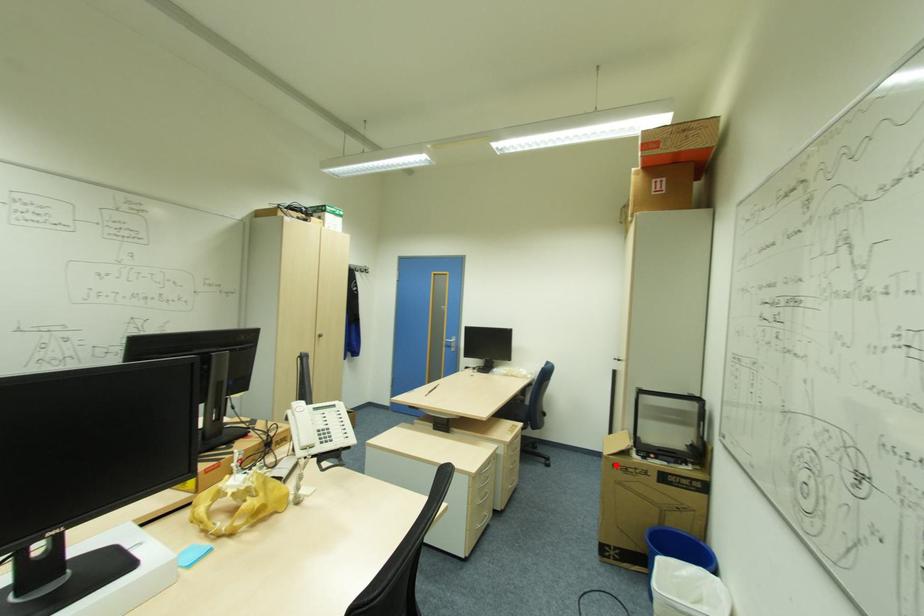
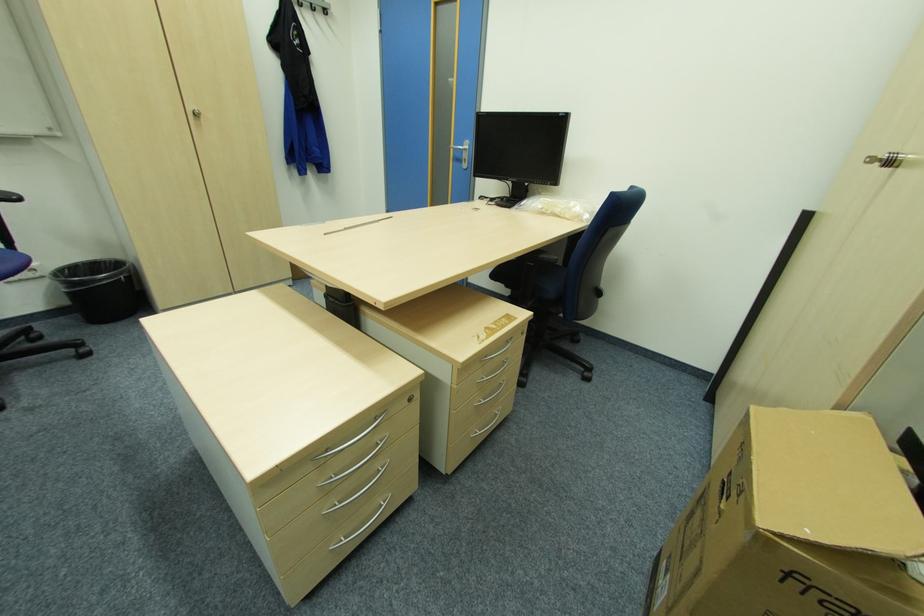
Question: A red point is marked in image1. In image2, is the corresponding 3D point closer to the camera or farther? Reply with the corresponding letter.

Choices:
 (A) The corresponding 3D point is closer.
 (B) The corresponding 3D point is farther.

Answer: (B)